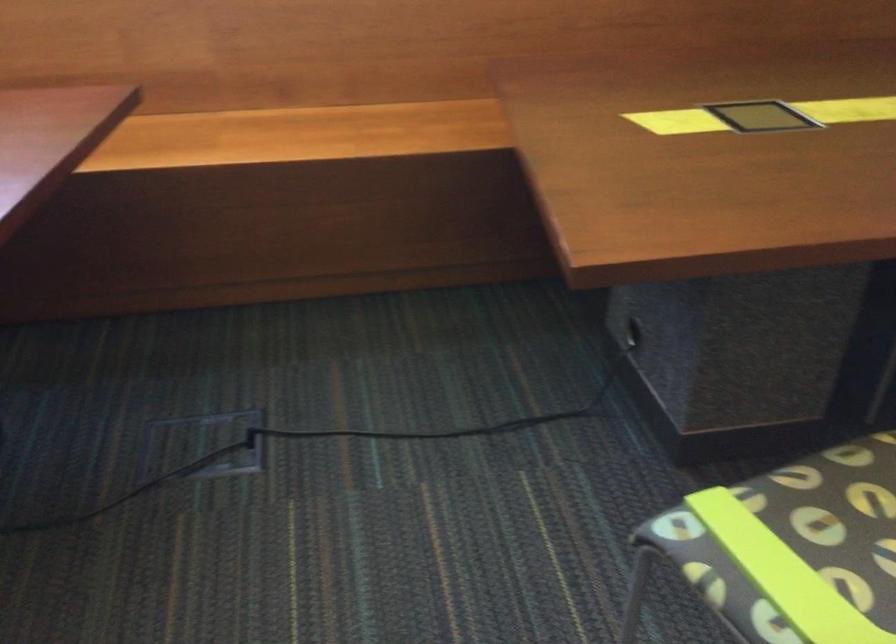
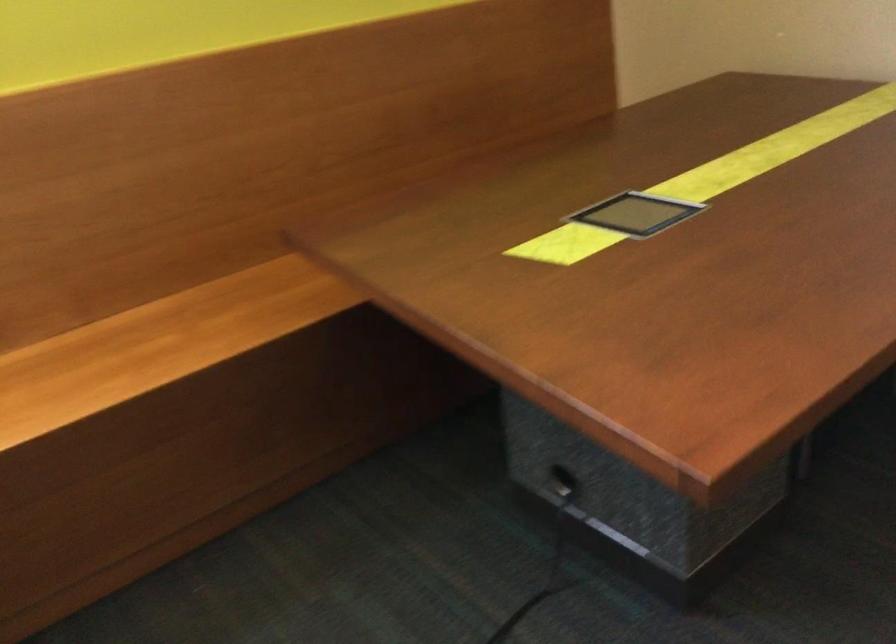
Question: The images are taken continuously from a first-person perspective. In which direction is your viewpoint rotating?

Choices:
 (A) Left
 (B) Right
 (C) Up
 (D) Down

Answer: (B)